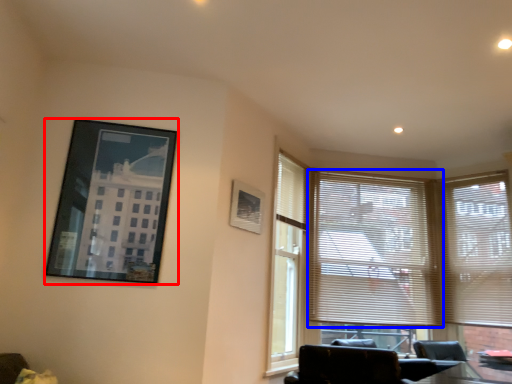
Question: Which point is closer to the camera, picture frame (highlighted by a red box) or window blind (highlighted by a blue box)?

Choices:
 (A) picture frame
 (B) window blind

Answer: (A)